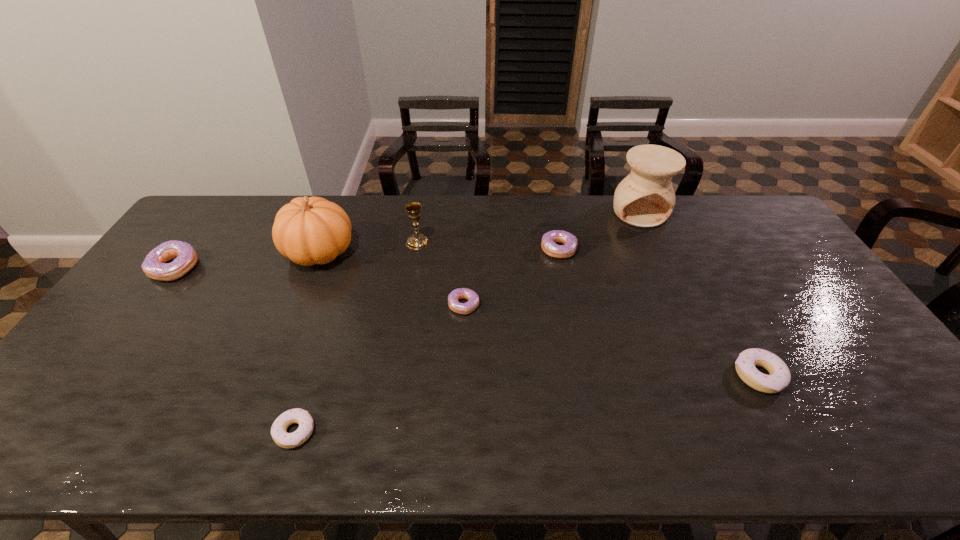
Identify the location of vacant region at the left edge of the desktop. (181, 285).

Locate an element on the screen. The image size is (960, 540). free space at the right edge of the desktop is located at coordinates (835, 353).

In the image, there is a desktop. Where is `free space at the far left corner`? The height and width of the screenshot is (540, 960). free space at the far left corner is located at coordinates (206, 217).

Where is `free location at the near left corner`? free location at the near left corner is located at coordinates (62, 433).

Identify the location of unoccupied area between the fifth shortest object and the pumpkin. (247, 260).

You are a GUI agent. You are given a task and a screenshot of the screen. Output one action in this format:
    pyautogui.click(x=<x>, y=<y>)
    Task: Click on the vacant space in between the third tallest object and the pottery
    Image resolution: width=960 pixels, height=540 pixels.
    Given the screenshot: What is the action you would take?
    pyautogui.click(x=529, y=227)

The width and height of the screenshot is (960, 540). I want to click on vacant space that is in between the right white doughnut and the second smallest purple doughnut, so click(659, 312).

Identify the location of vacant region between the fourth object from right to left and the orange pumpkin. (392, 279).

Locate an element on the screen. This screenshot has width=960, height=540. free space between the bigger white doughnut and the nearest doughnut is located at coordinates (527, 403).

The width and height of the screenshot is (960, 540). In order to click on unoccupied position between the rightmost purple doughnut and the fifth object from right to left in this screenshot , I will do `click(489, 246)`.